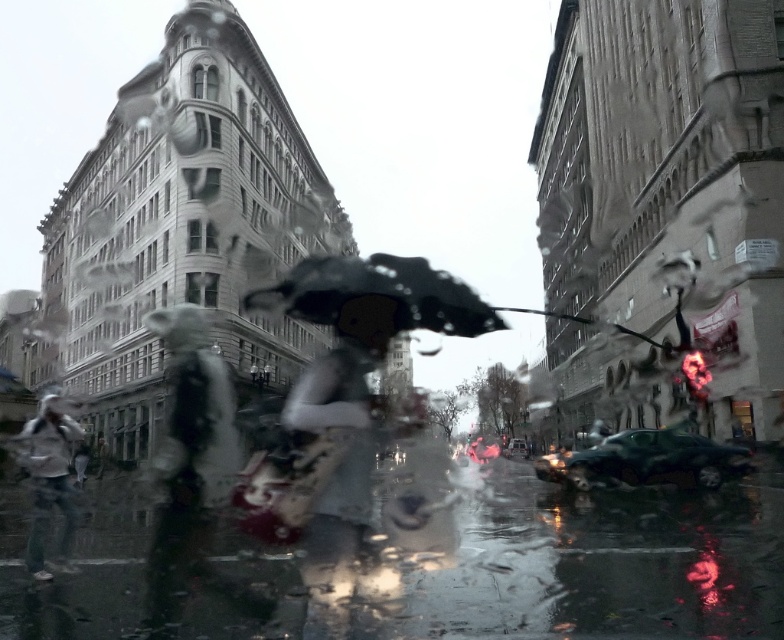
You are driving a car with a passenger who wants to reach a destination 5 meters away. The passenger sees the matte black umbrella at center through the rainy window. Can they safely exit the car to walk that distance without the umbrella?

The matte black umbrella at center is 5.03 meters away from viewer. Since the destination is 5 meters away, the distance is almost the same. However, the passenger should consider that the umbrella is slightly farther than the destination, so exiting might be risky if the rain is heavy. It would be safer to wait for shelter closer by.

You are a pedestrian trying to cross the street during a heavy rain. You have two umbrellas available in the scene, the dark gray fabric umbrella at center and the transparent plastic umbrella at center. Which umbrella would provide better visibility while walking?

The transparent plastic umbrella at center allows more light to pass through, providing better visibility compared to the dark gray fabric umbrella at center.